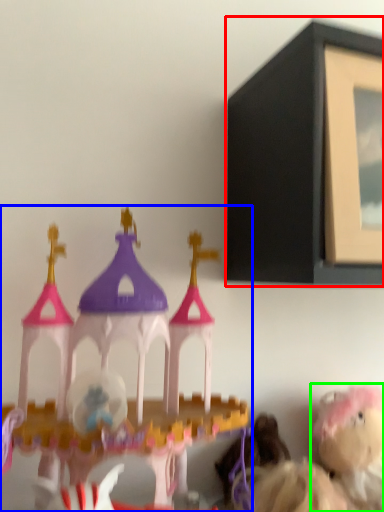
Question: Which object is positioned closest to picture frame (highlighted by a red box)? Select from toy (highlighted by a blue box) and toy (highlighted by a green box).

Choices:
 (A) toy
 (B) toy

Answer: (A)